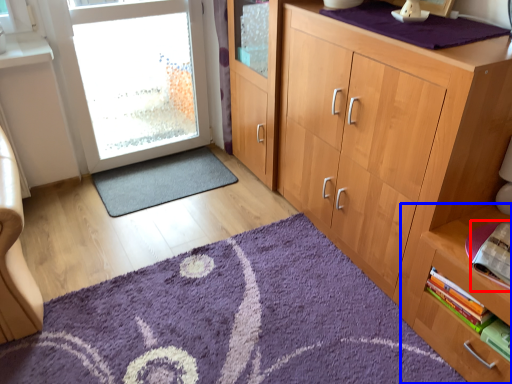
Question: Among these objects, which one is nearest to the camera, book (highlighted by a red box) or shelf (highlighted by a blue box)?

Choices:
 (A) book
 (B) shelf

Answer: (B)